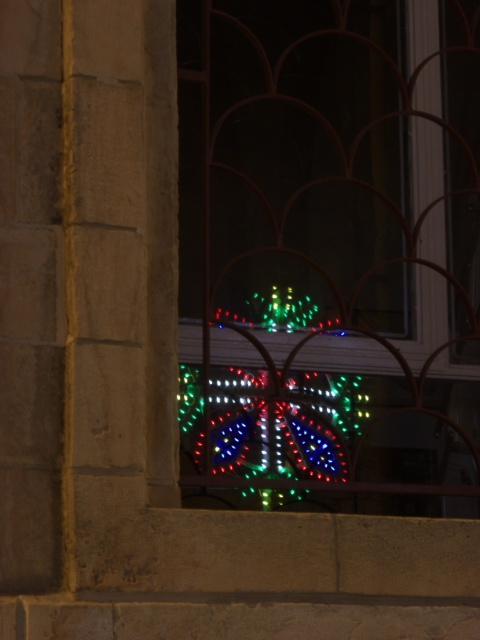
You are a window cleaner holding a 24 inch ladder. You need to reach both the led lights at center and the illuminated plastic lights at center. Can you safely use the ladder to reach both without moving it?

The distance between the led lights at center and the illuminated plastic lights at center is 24.51 inches. Since the ladder is 24 inches long, it is slightly shorter than the required distance. Therefore, the ladder may not be long enough to safely reach both objects without moving it.

You are standing in a room with a window that has a decorative metal grille. You notice two types of lights outside the window through the grille. The first is led lights at center, and the second is illuminated plastic lights at center. Which of these two lights is closer to the window?

The led lights at center is closer to the window because it is in front of the illuminated plastic lights at center.

You are standing in a room with a window that has a decorative metal grille. You see a point at coordinates point [210,264] outside the window. If you want to reach that point with a 10 meter long pole, can you reach it?

The distance of point [210,264] from camera is 8.63 meters, so yes, the pole is long enough to reach it since it is shorter than the pole length.